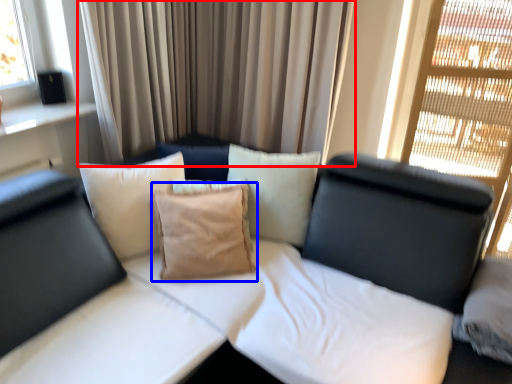
Question: Which object is further to the camera taking this photo, curtain (highlighted by a red box) or pillow (highlighted by a blue box)?

Choices:
 (A) curtain
 (B) pillow

Answer: (A)